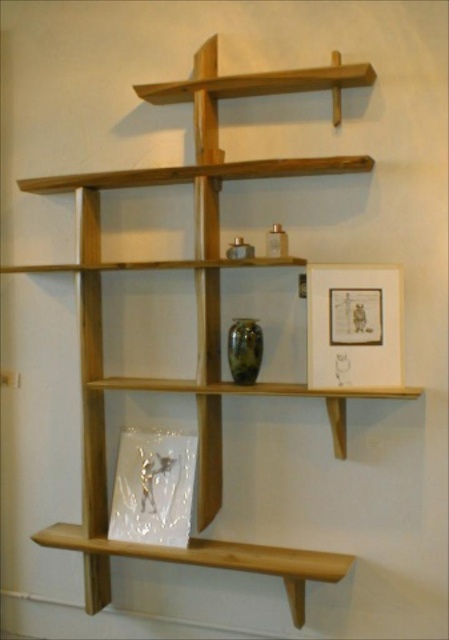
You are standing in front of the wooden shelving unit and want to reach the point at coordinates point (324, 304). If your arm can extend 1.7 meters, can you reach that point?

The distance between you and point (324, 304) is 1.85 meters. Since your arm can only extend 1.7 meters, you cannot reach the point.

You are an interior designer arranging items on the wooden shelving unit. You have a matte white picture frame at upper right and a wooden shelf at lower center. Which object has a smaller width?

The matte white picture frame at upper right has a lesser width compared to the wooden shelf at lower center.